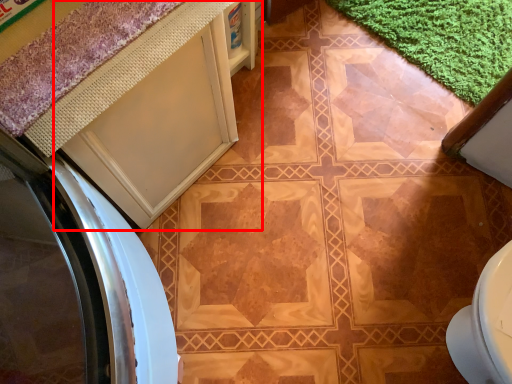
Question: Observing the image, what is the correct spatial positioning of cabinetry (annotated by the red box) in reference to bath mat?

Choices:
 (A) left
 (B) right

Answer: (A)